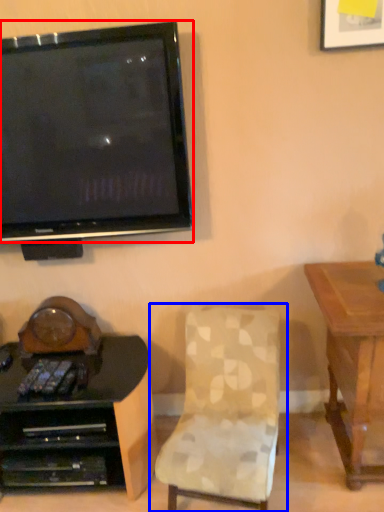
Question: Which object is closer to the camera taking this photo, television (highlighted by a red box) or chair (highlighted by a blue box)?

Choices:
 (A) television
 (B) chair

Answer: (B)